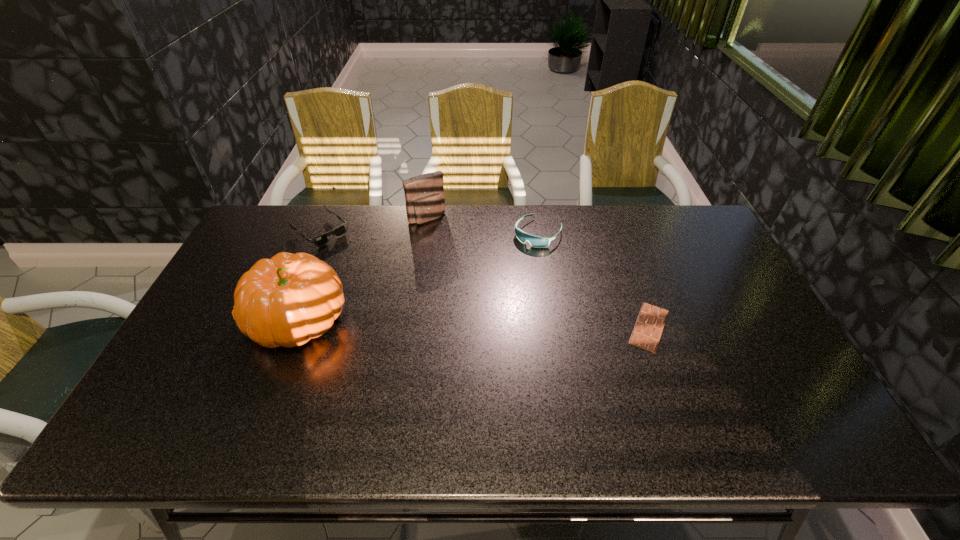
At what (x,y) coordinates should I click in order to perform the action: click on free region located 0.090m on the carved face of the pumpkin. Please return your answer as a coordinate pair (x, y). Looking at the image, I should click on (216, 319).

Locate an element on the screen. This screenshot has width=960, height=540. free point located on the left of the chocolate bar is located at coordinates (525, 327).

Find the location of a particular element. free space located on the front-facing side of the third shortest object is located at coordinates (502, 275).

Identify the location of vacant space located 0.190m on the front-facing side of the third shortest object. The height and width of the screenshot is (540, 960). (497, 281).

Where is `vacant space located 0.160m on the front-facing side of the third shortest object`? The image size is (960, 540). vacant space located 0.160m on the front-facing side of the third shortest object is located at coordinates (502, 275).

Find the location of a particular element. vacant space located 0.110m on the temples of the sunglasses is located at coordinates (354, 261).

Image resolution: width=960 pixels, height=540 pixels. What are the coordinates of `blank space located on the temples of the sunglasses` in the screenshot? It's located at (409, 307).

Image resolution: width=960 pixels, height=540 pixels. I want to click on free space located 0.190m on the temples of the sunglasses, so click(369, 273).

I want to click on vacant area located with an open flap on the third object from left to right, so click(478, 279).

Find the location of a particular element. free spot located with an open flap on the third object from left to right is located at coordinates (473, 273).